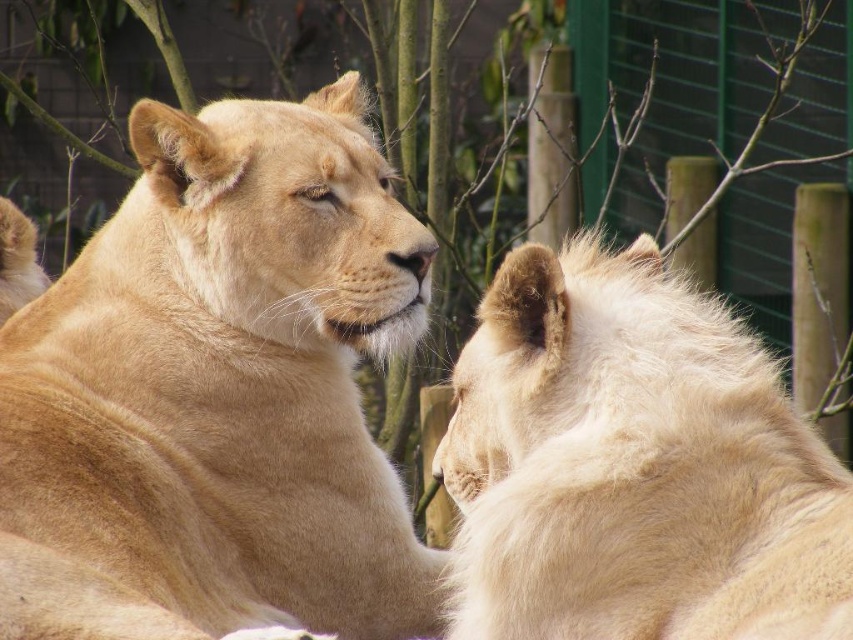
You are a zookeeper who needs to prepare food portions based on the lions size. Given that the golden fur lion at center is larger than the fuzzy white lion at right, how should you adjust their food portions?

The golden fur lion at center requires a larger portion of food compared to the fuzzy white lion at right due to its bigger size.

You are a zookeeper who needs to prepare feeding areas for the golden fur lion at center and the fuzzy white lion at right. Since their feeding stations must be placed according to their height, which lion requires a taller feeding station?

The golden fur lion at center requires a taller feeding station because it is taller than the fuzzy white lion at right.